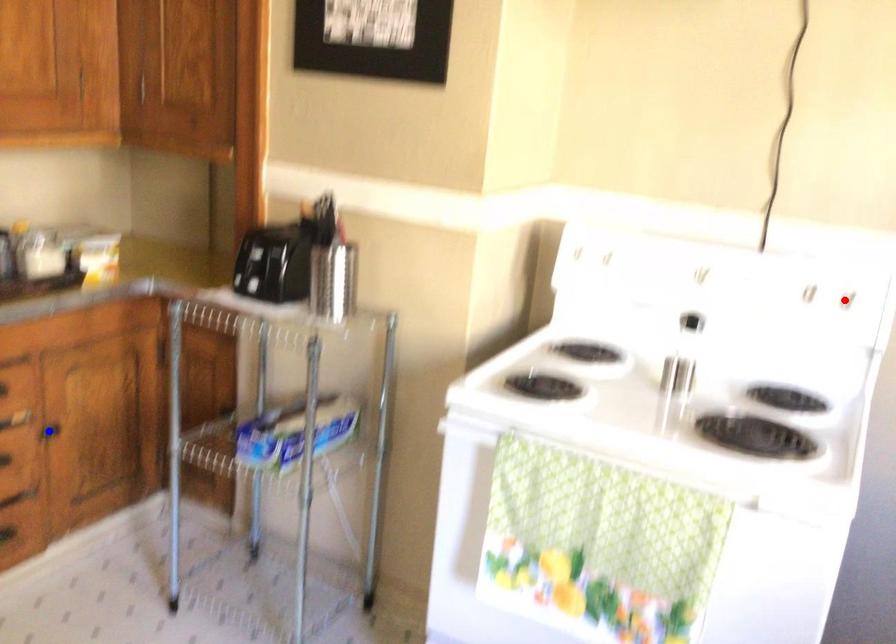
Question: In the image, two points are highlighted. Which point is nearer to the camera? Reply with the corresponding letter.

Choices:
 (A) blue point
 (B) red point

Answer: (B)